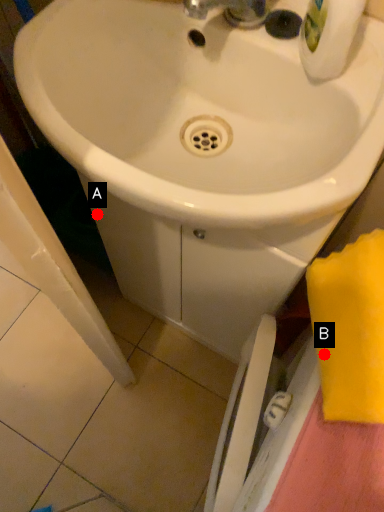
Question: Two points are circled on the image, labeled by A and B beside each circle. Which point appears closest to the camera in this image?

Choices:
 (A) A is closer
 (B) B is closer

Answer: (B)